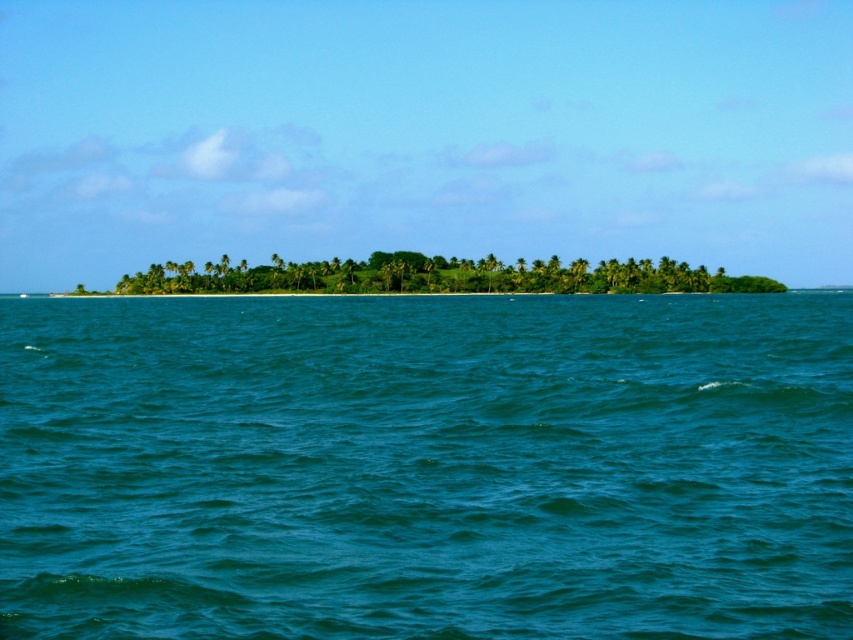
Does teal glossy water at center have a smaller size compared to green leafy island at center?

Actually, teal glossy water at center might be larger than green leafy island at center.

Does teal glossy water at center appear on the left side of green leafy island at center?

Incorrect, teal glossy water at center is not on the left side of green leafy island at center.

Identify the location of teal glossy water at center. The image size is (853, 640). (426, 467).